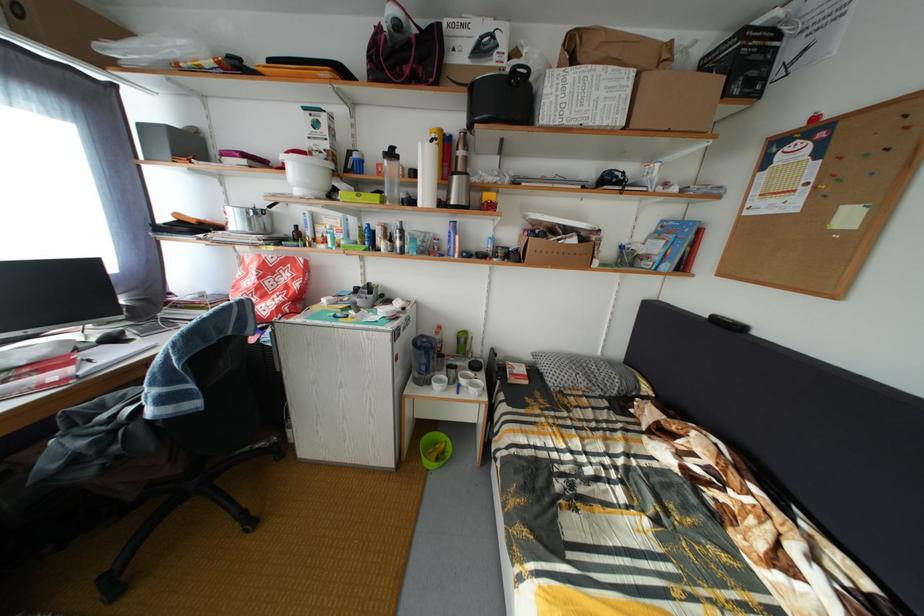
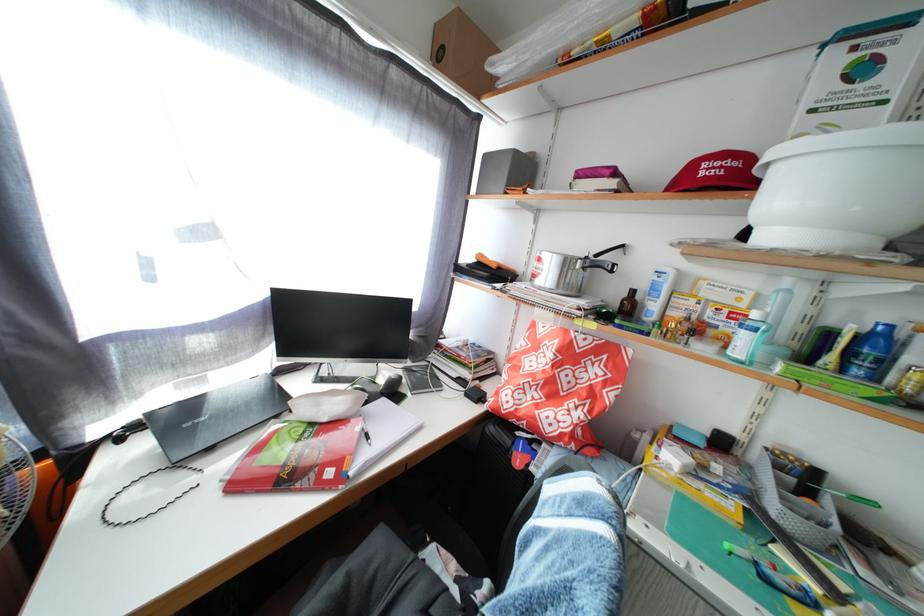
Where in the second image is the point corresponding to pixel 185 221 from the first image?

(489, 262)